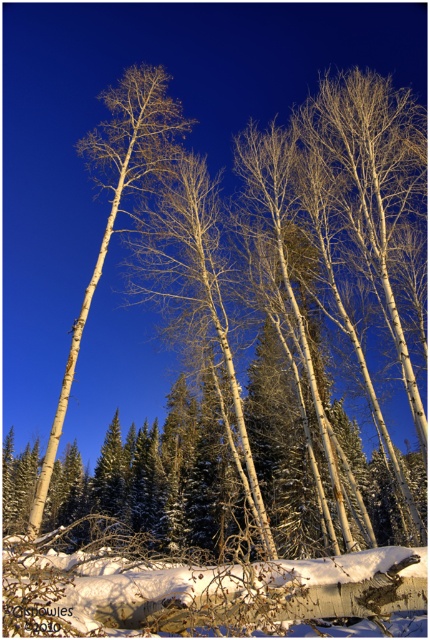
Question: From the image, what is the correct spatial relationship of white fluffy snow at lower center in relation to white matte birch tree at left?

Choices:
 (A) right
 (B) left

Answer: (A)

Question: Does white fluffy snow at lower center appear over white matte birch tree at left?

Choices:
 (A) no
 (B) yes

Answer: (A)

Question: Is white fluffy snow at lower center positioned in front of white matte birch tree at left?

Choices:
 (A) no
 (B) yes

Answer: (B)

Question: Among these points, which one is nearest to the camera?

Choices:
 (A) (128, 561)
 (B) (74, 365)

Answer: (A)